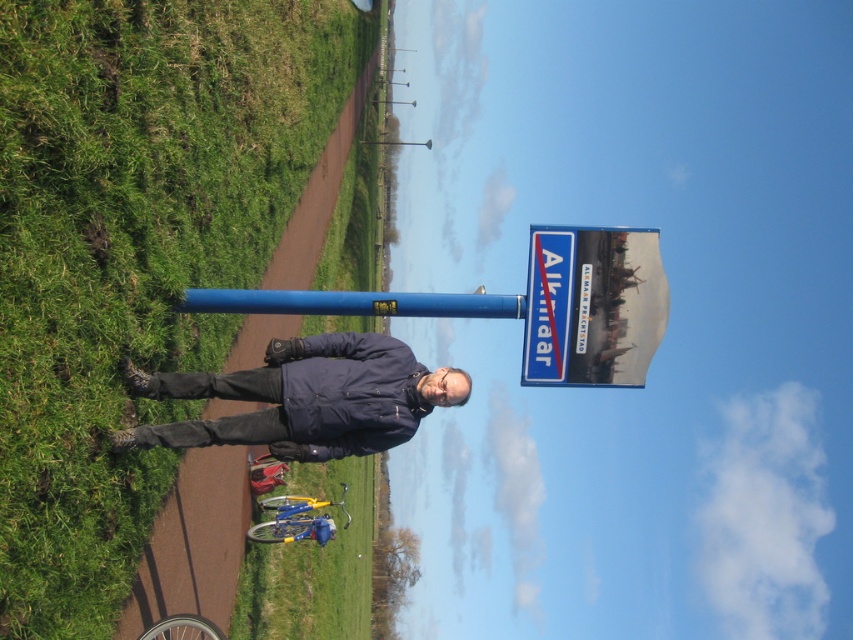
Which of these two, dark blue jacket at center or blue metallic pole at center, stands taller?

Standing taller between the two is dark blue jacket at center.

Can you confirm if dark blue jacket at center is positioned to the left of blue metallic pole at center?

Correct, you'll find dark blue jacket at center to the left of blue metallic pole at center.

Find the location of a particular element. dark blue jacket at center is located at coordinates (306, 397).

The image size is (853, 640). I want to click on dark blue jacket at center, so [306, 397].

Based on the photo, can you confirm if green grass at lower left is positioned to the left of blue plastic sign at upper center?

Yes, green grass at lower left is to the left of blue plastic sign at upper center.

Looking at this image, does green grass at lower left have a lesser width compared to blue plastic sign at upper center?

Yes.

Does point (113, 536) come in front of point (607, 348)?

Yes, point (113, 536) is closer to viewer.

Identify the location of green grass at lower left. The image size is (853, 640). (132, 250).

Who is positioned more to the right, dark blue jacket at center or blue plastic sign at upper center?

blue plastic sign at upper center is more to the right.

Is point (392, 390) closer to camera compared to point (654, 253)?

That is True.

Between point (311, 451) and point (560, 336), which one is positioned in front?

Point (560, 336)

Identify the location of dark blue jacket at center. [x=306, y=397].